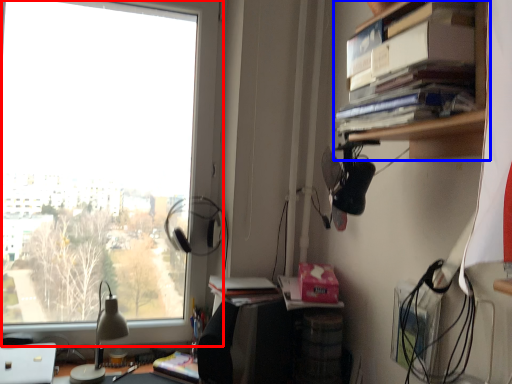
Question: Which of the following is the closest to the observer, window (highlighted by a red box) or cabinetry (highlighted by a blue box)?

Choices:
 (A) window
 (B) cabinetry

Answer: (B)